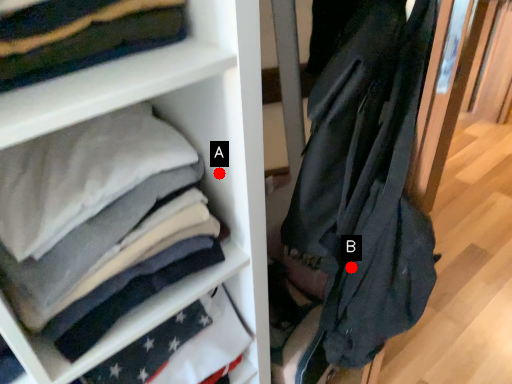
Question: Two points are circled on the image, labeled by A and B beside each circle. Which point is closer to the camera?

Choices:
 (A) A is closer
 (B) B is closer

Answer: (A)